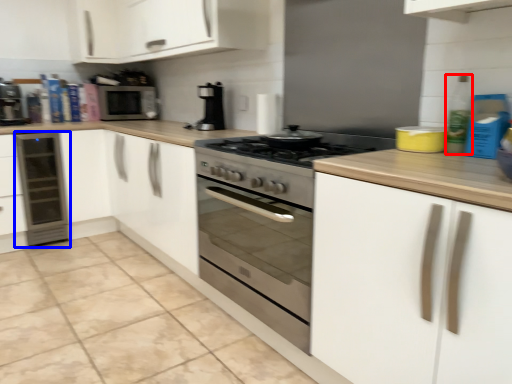
Question: Which of the following is the farthest to the observer, bottle (highlighted by a red box) or home appliance (highlighted by a blue box)?

Choices:
 (A) bottle
 (B) home appliance

Answer: (B)